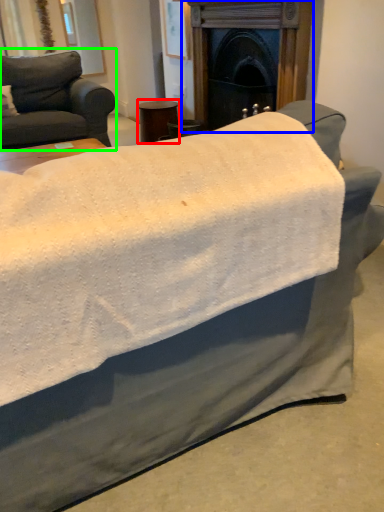
Question: Which is nearer to the side table (highlighted by a red box)? fireplace (highlighted by a blue box) or studio couch (highlighted by a green box).

Choices:
 (A) fireplace
 (B) studio couch

Answer: (B)